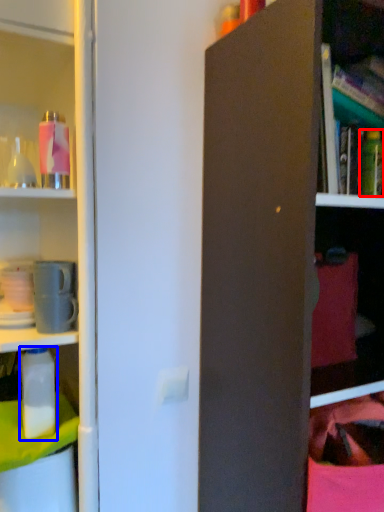
Question: Which of the following is the closest to the observer, bottle (highlighted by a red box) or bottle (highlighted by a blue box)?

Choices:
 (A) bottle
 (B) bottle

Answer: (B)